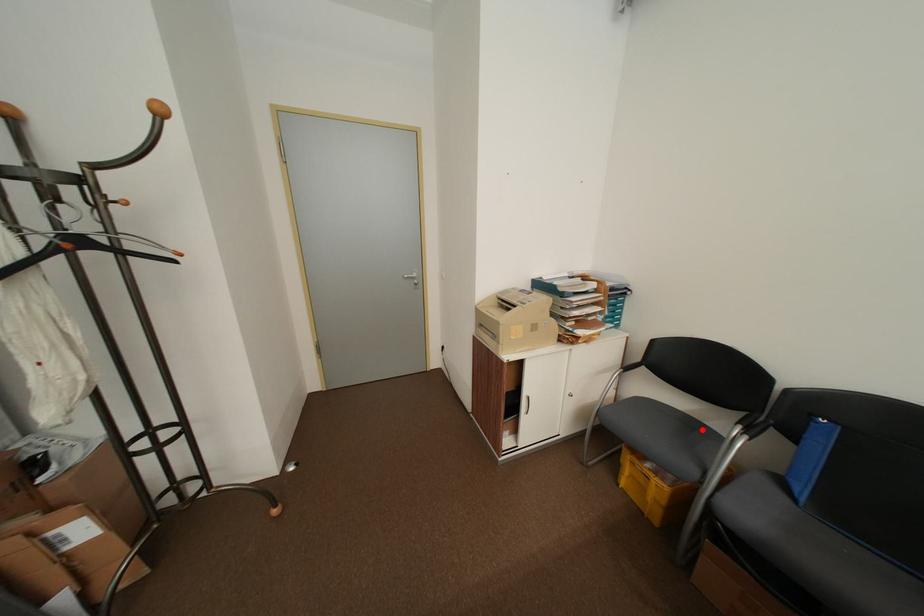
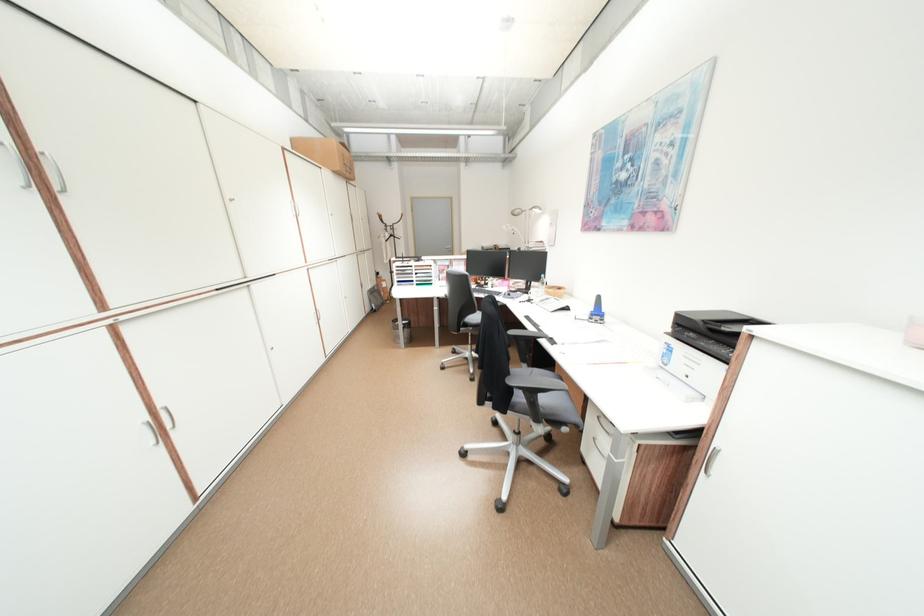
Question: I am providing you with two images of the same scene from different viewpoints. A red point is marked on the first image. Is the red point's position out of view in image 2?

Choices:
 (A) Yes
 (B) No

Answer: (A)